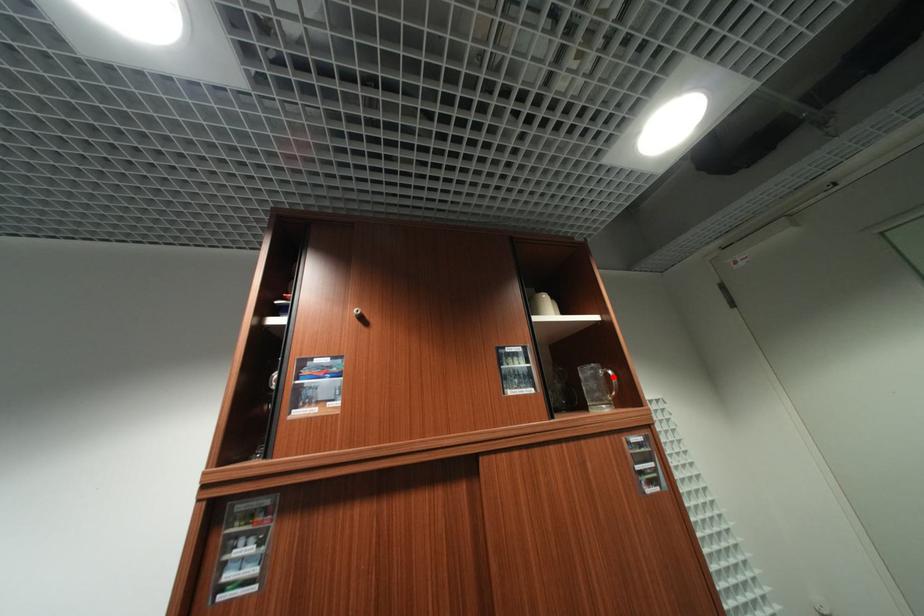
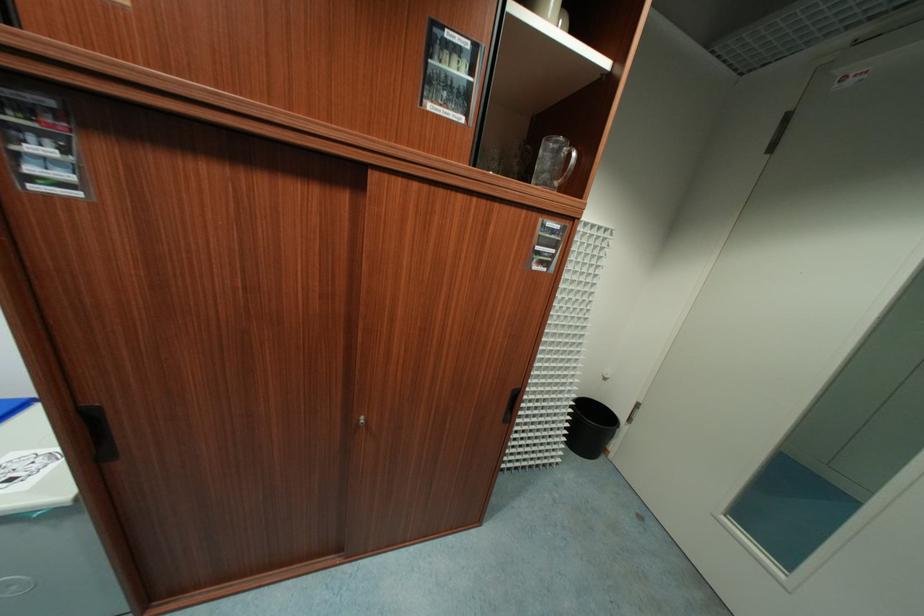
Find the pixel in the second image that matches the highlighted location in the first image.

(574, 158)